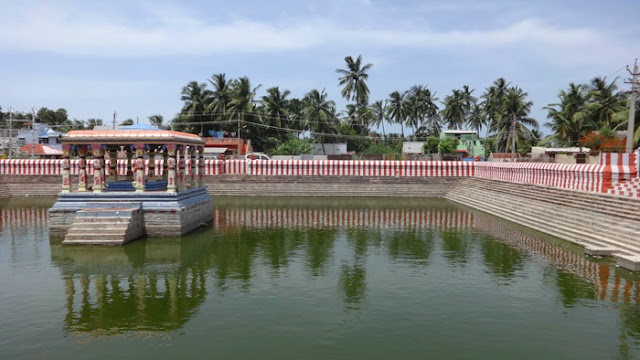
You are a GUI agent. You are given a task and a screenshot of the screen. Output one action in this format:
    pyautogui.click(x=<x>, y=<y>)
    Task: Click on the pillar
    Image resolution: width=640 pixels, height=360 pixels.
    Given the screenshot: What is the action you would take?
    pyautogui.click(x=82, y=178)